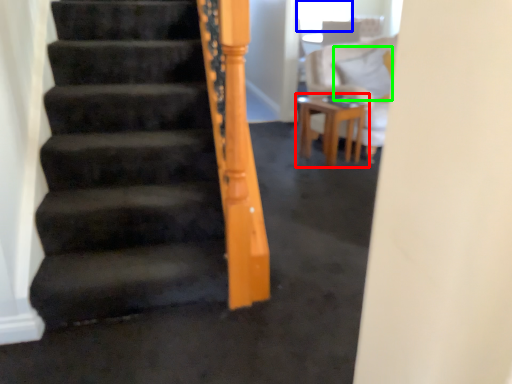
Question: Based on their relative distances, which object is farther from table (highlighted by a red box)? Choose from window screen (highlighted by a blue box) and pillow (highlighted by a green box).

Choices:
 (A) window screen
 (B) pillow

Answer: (A)